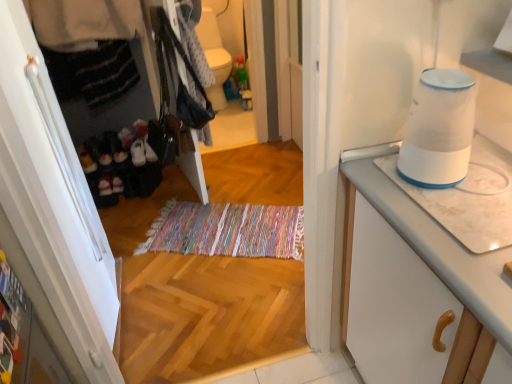
The height and width of the screenshot is (384, 512). What do you see at coordinates (120, 165) in the screenshot? I see `black fabric shoes at left` at bounding box center [120, 165].

What is the approximate height of black fabric shoes at left?

→ black fabric shoes at left is 17.39 inches tall.

You are a GUI agent. You are given a task and a screenshot of the screen. Output one action in this format:
    pyautogui.click(x=<x>, y=<y>)
    Task: Click on the white plastic humidifier at upper right
    The image size is (512, 384).
    Given the screenshot: What is the action you would take?
    pyautogui.click(x=439, y=130)

This screenshot has width=512, height=384. What do you see at coordinates (416, 287) in the screenshot?
I see `white marble countertop at right` at bounding box center [416, 287].

This screenshot has width=512, height=384. I want to click on white glossy toilet bowl at upper center, so click(x=214, y=57).

Is white glossy toilet bowl at upper center to the left of white matte cabinet at left from the viewer's perspective?

No.

From the picture: Who is smaller, white glossy toilet bowl at upper center or white matte cabinet at left?

With smaller size is white glossy toilet bowl at upper center.

From a real-world perspective, which is physically above, white glossy toilet bowl at upper center or white matte cabinet at left?

white matte cabinet at left.

Is point (211, 55) behind point (18, 226)?

Yes, it is behind point (18, 226).

This screenshot has height=384, width=512. Identify the location of footwear on the left side of white matte cabinet at left. (120, 165).

Does black fabric shoes at left have a greater height compared to white matte cabinet at left?

No.

From the image's perspective, is black fabric shoes at left above or below white matte cabinet at left?

black fabric shoes at left is above white matte cabinet at left.

Is black fabric shoes at left to the left of white matte cabinet at left from the viewer's perspective?

Yes, black fabric shoes at left is to the left of white matte cabinet at left.

How different are the orientations of black fabric shoes at left and white marble countertop at right in degrees?

They differ by 90.3 degrees in their facing directions.

Between black fabric shoes at left and white marble countertop at right, which one appears on the left side from the viewer's perspective?

From the viewer's perspective, black fabric shoes at left appears more on the left side.

This screenshot has height=384, width=512. In the image, there is a black fabric shoes at left. Identify the location of countertop below it (from the image's perspective). (416, 287).

How distant is black fabric shoes at left from white marble countertop at right?

A distance of 5.93 feet exists between black fabric shoes at left and white marble countertop at right.

Considering the positions of objects white marble countertop at right and white glossy toilet bowl at upper center in the image provided, who is more to the left, white marble countertop at right or white glossy toilet bowl at upper center?

Positioned to the left is white glossy toilet bowl at upper center.

From the image's perspective, does white marble countertop at right appear higher than white glossy toilet bowl at upper center?

No, from the image's perspective, white marble countertop at right is not over white glossy toilet bowl at upper center.

Is white marble countertop at right positioned with its back to white glossy toilet bowl at upper center?

white marble countertop at right does not have its back to white glossy toilet bowl at upper center.

Considering the relative sizes of white marble countertop at right and white matte cabinet at left in the image provided, is white marble countertop at right shorter than white matte cabinet at left?

Yes.

How different are the orientations of white marble countertop at right and white matte cabinet at left in degrees?

179 degrees.

Looking at this image, is white marble countertop at right facing towards white matte cabinet at left?

No, white marble countertop at right is not aimed at white matte cabinet at left.

In the image, is white marble countertop at right positioned in front of or behind white matte cabinet at left?

In the image, white marble countertop at right appears in front of white matte cabinet at left.

How different are the orientations of white plastic humidifier at upper right and white glossy toilet bowl at upper center in degrees?

white plastic humidifier at upper right and white glossy toilet bowl at upper center are facing 84.8 degrees away from each other.

From a real-world perspective, is white plastic humidifier at upper right physically located above or below white glossy toilet bowl at upper center?

white plastic humidifier at upper right is situated higher than white glossy toilet bowl at upper center in the real world.

Which of these two, white plastic humidifier at upper right or white glossy toilet bowl at upper center, is smaller?

With smaller size is white plastic humidifier at upper right.

Is white plastic humidifier at upper right wider than white glossy toilet bowl at upper center?

No, white plastic humidifier at upper right is not wider than white glossy toilet bowl at upper center.

Who is smaller, black fabric shoes at left or white glossy toilet bowl at upper center?

With smaller size is black fabric shoes at left.

Where is `footwear on the left of white glossy toilet bowl at upper center`? The width and height of the screenshot is (512, 384). footwear on the left of white glossy toilet bowl at upper center is located at coordinates (120, 165).

Is black fabric shoes at left facing away from white glossy toilet bowl at upper center?

No, black fabric shoes at left's orientation is not away from white glossy toilet bowl at upper center.

Considering the relative positions of black fabric shoes at left and white glossy toilet bowl at upper center in the image provided, is black fabric shoes at left behind white glossy toilet bowl at upper center?

No, the depth of black fabric shoes at left is less than that of white glossy toilet bowl at upper center.

Identify the location of cabinetry that appears below the white glossy toilet bowl at upper center (from the image's perspective). (53, 214).

Image resolution: width=512 pixels, height=384 pixels. I want to click on cabinetry on the right of black fabric shoes at left, so click(53, 214).

When comparing their distances from white plastic humidifier at upper right, does white matte cabinet at left or black fabric shoes at left seem further?

The object further to white plastic humidifier at upper right is black fabric shoes at left.

Based on their spatial positions, is white glossy toilet bowl at upper center or white plastic humidifier at upper right further from white marble countertop at right?

The object further to white marble countertop at right is white glossy toilet bowl at upper center.

Considering their positions, is black fabric shoes at left positioned further to white plastic humidifier at upper right than white matte cabinet at left?

Based on the image, black fabric shoes at left appears to be further to white plastic humidifier at upper right.

Based on their spatial positions, is white glossy toilet bowl at upper center or white marble countertop at right further from white matte cabinet at left?

Based on the image, white glossy toilet bowl at upper center appears to be further to white matte cabinet at left.

Based on their spatial positions, is black fabric shoes at left or white matte cabinet at left further from white glossy toilet bowl at upper center?

white matte cabinet at left lies further to white glossy toilet bowl at upper center than the other object.

From the image, which object appears to be nearer to white marble countertop at right, black fabric shoes at left or white plastic humidifier at upper right?

white plastic humidifier at upper right is closer to white marble countertop at right.

Which object lies further to the anchor point white plastic humidifier at upper right, white marble countertop at right or white matte cabinet at left?

white matte cabinet at left.

Considering their positions, is white matte cabinet at left positioned further to black fabric shoes at left than white plastic humidifier at upper right?

white plastic humidifier at upper right lies further to black fabric shoes at left than the other object.

Identify the location of cabinetry between white plastic humidifier at upper right and black fabric shoes at left along the z-axis. Image resolution: width=512 pixels, height=384 pixels. (53, 214).

Find the location of a particular element. The height and width of the screenshot is (384, 512). home appliance located between white marble countertop at right and black fabric shoes at left in the depth direction is located at coordinates (439, 130).

Locate an element on the screen. This screenshot has width=512, height=384. footwear between white marble countertop at right and white glossy toilet bowl at upper center along the z-axis is located at coordinates (120, 165).

Where is `cabinetry between white marble countertop at right and black fabric shoes at left along the z-axis`? The height and width of the screenshot is (384, 512). cabinetry between white marble countertop at right and black fabric shoes at left along the z-axis is located at coordinates pos(53,214).